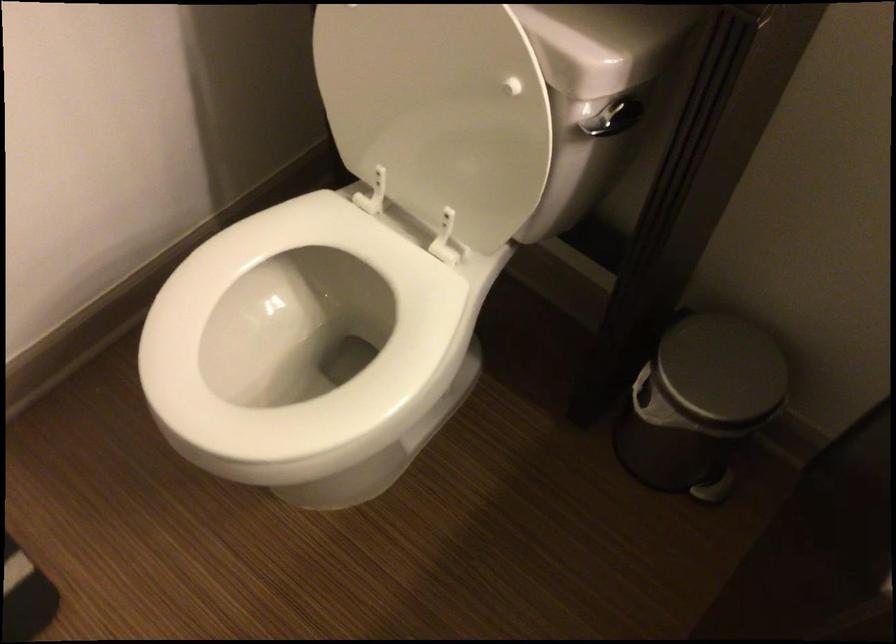
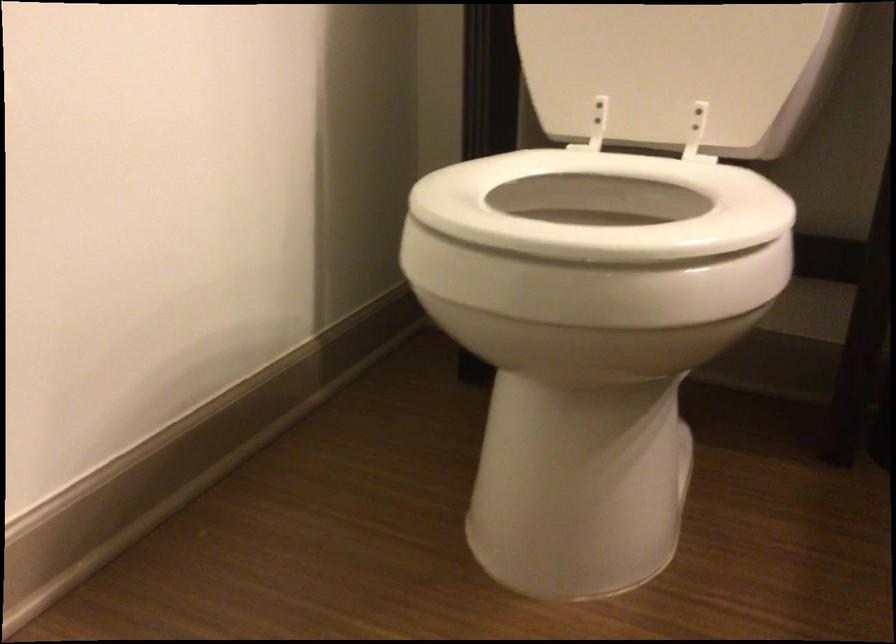
First-person continuous shooting, in which direction is the camera rotating?

The camera rotated toward right-up.